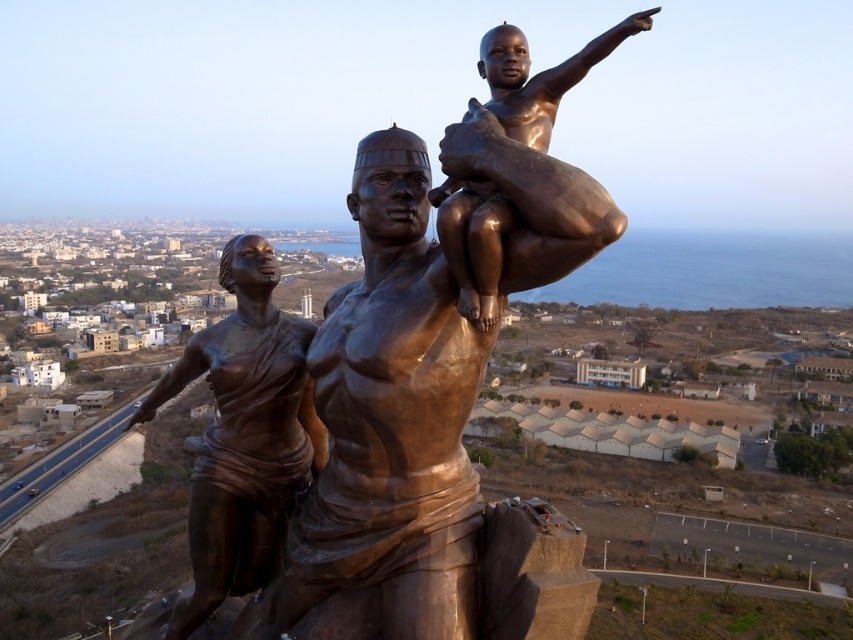
Question: Among these objects, which one is nearest to the camera?

Choices:
 (A) shiny bronze statue at left
 (B) bronze statue at center

Answer: (B)

Question: Does bronze statue at center have a larger size compared to shiny bronze statue at left?

Choices:
 (A) no
 (B) yes

Answer: (B)

Question: Is bronze statue at center further to the viewer compared to shiny bronze statue at left?

Choices:
 (A) no
 (B) yes

Answer: (A)

Question: Is bronze statue at center to the right of shiny bronze statue at left from the viewer's perspective?

Choices:
 (A) no
 (B) yes

Answer: (B)

Question: Which object appears farthest from the camera in this image?

Choices:
 (A) shiny bronze statue at left
 (B) bronze statue at center

Answer: (A)